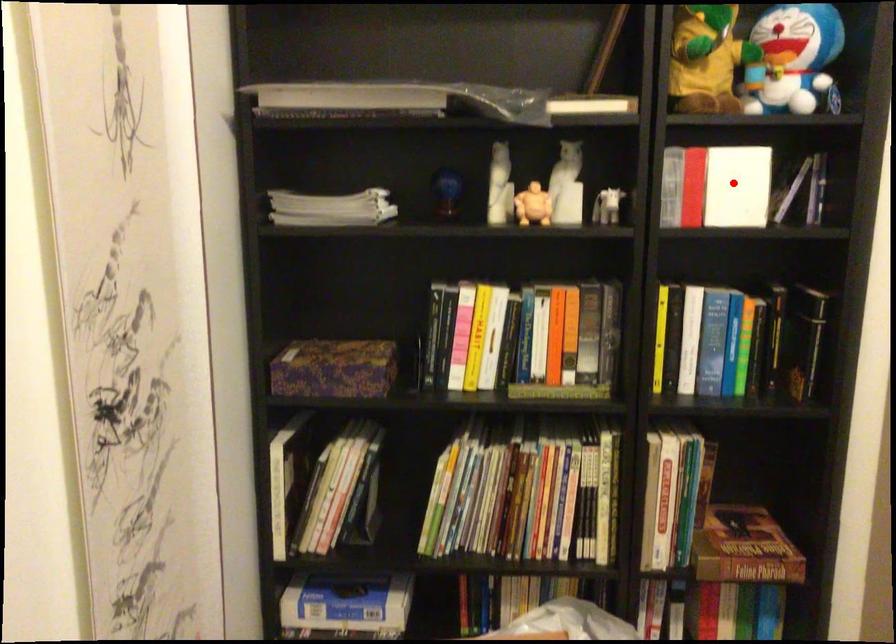
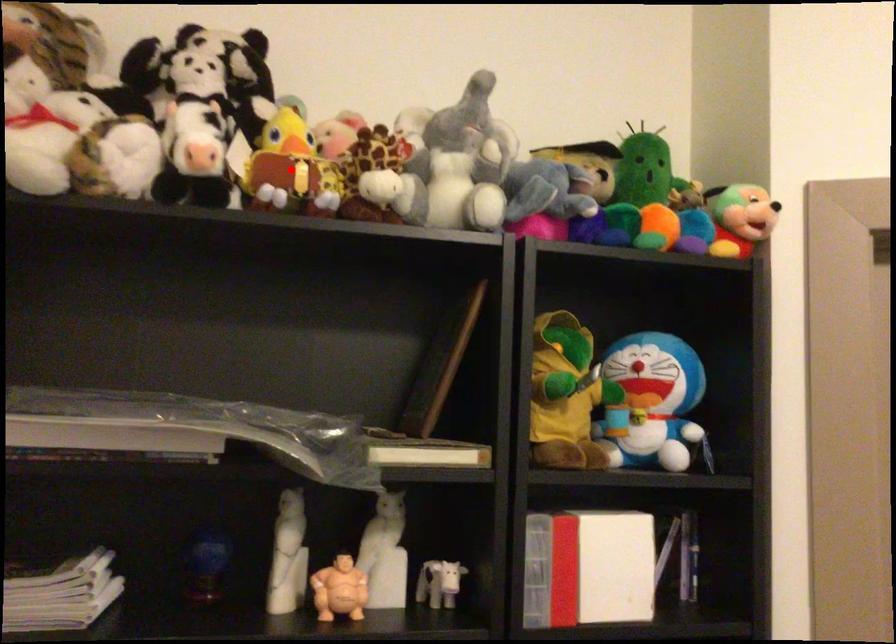
I am providing you with two images of the same scene from different viewpoints. A red point is marked on the first image and another point is marked on the second image. Do the highlighted points in image1 and image2 indicate the same real-world spot?

No